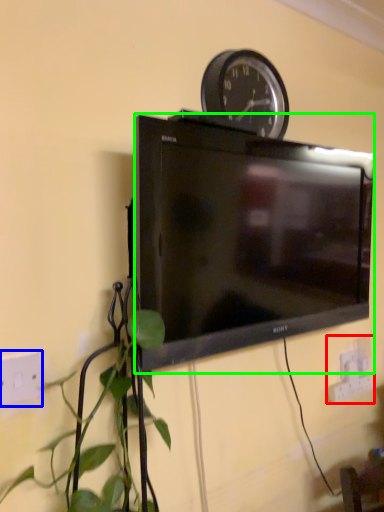
Question: Which object is positioned closest to electric outlet (highlighted by a red box)? Select from electric outlet (highlighted by a blue box) and television (highlighted by a green box).

Choices:
 (A) electric outlet
 (B) television

Answer: (B)